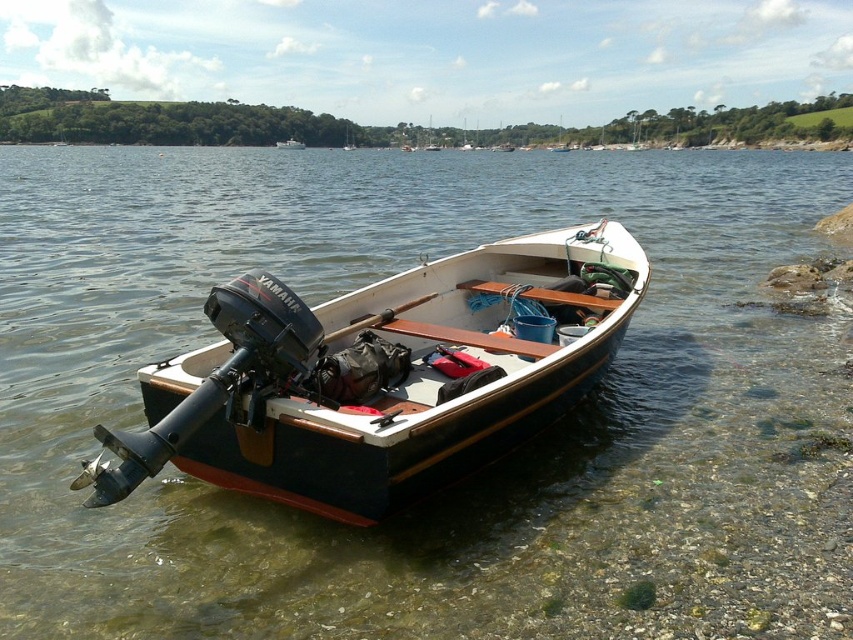
You are standing on the dock and want to reach the point marked as point (117, 472) on the boat. If your maximum reach is 3 meters, can you touch it without moving closer?

The point (117, 472) is 3.27 meters away from the camera, so you cannot touch it with a maximum reach of 3 meters. You need to move closer by at least 0.27 meters.